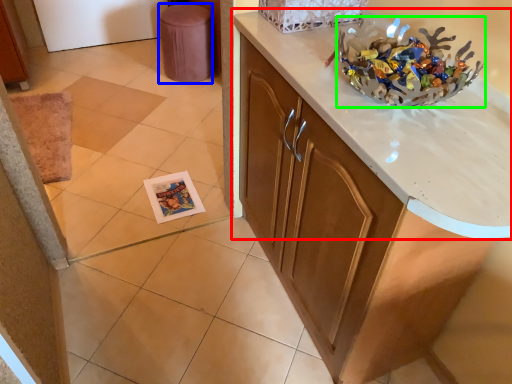
Question: Which is farther away from countertop (highlighted by a red box)? stool (highlighted by a blue box) or stuff (highlighted by a green box)?

Choices:
 (A) stool
 (B) stuff

Answer: (A)